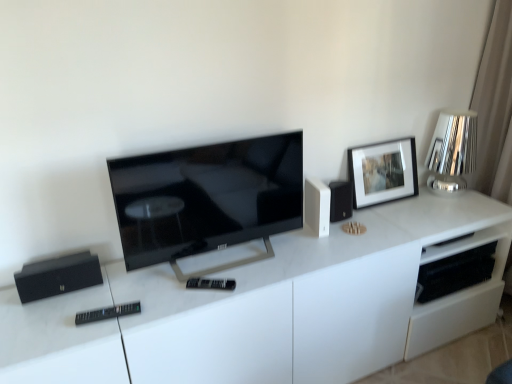
The image size is (512, 384). What are the coordinates of `free space in front of matte black tv at center` in the screenshot? It's located at (202, 297).